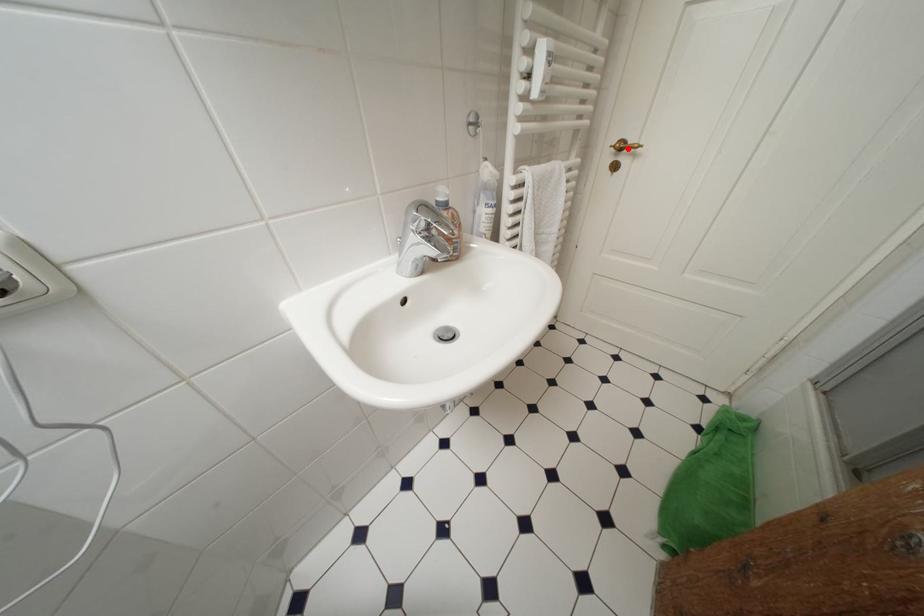
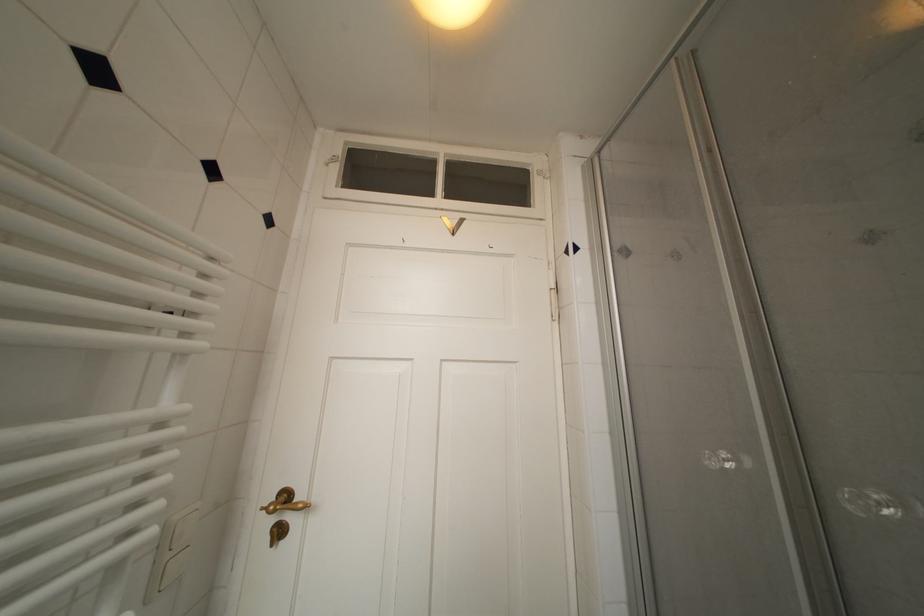
Find the pixel in the second image that matches the highlighted location in the first image.

(293, 500)